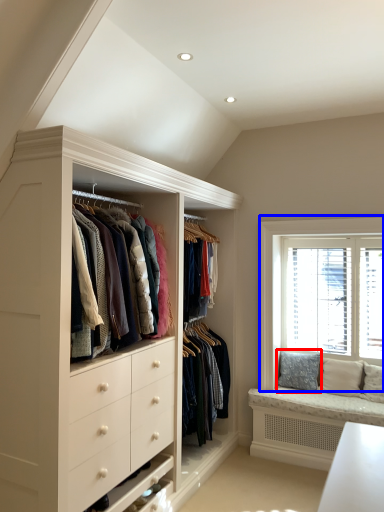
Question: Which object appears closest to the camera in this image, pillow (highlighted by a red box) or window (highlighted by a blue box)?

Choices:
 (A) pillow
 (B) window

Answer: (B)